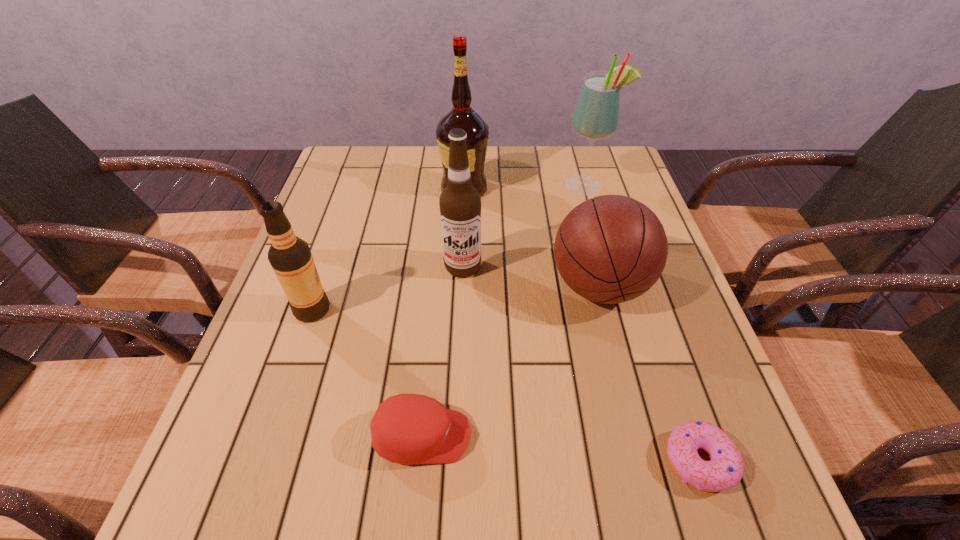
You are a GUI agent. You are given a task and a screenshot of the screen. Output one action in this format:
    pyautogui.click(x=<x>, y=<y>)
    Task: Click on the free space at the far edge of the desktop
    
    Given the screenshot: What is the action you would take?
    pyautogui.click(x=431, y=146)

Where is `vacant space at the near edge of the desktop`? The width and height of the screenshot is (960, 540). vacant space at the near edge of the desktop is located at coordinates (409, 489).

Locate an element on the screen. This screenshot has height=540, width=960. vacant position at the left edge of the desktop is located at coordinates (320, 199).

This screenshot has height=540, width=960. I want to click on free space at the right edge of the desktop, so click(x=676, y=388).

Identify the location of vacant space at the far left corner of the desktop. (322, 186).

The height and width of the screenshot is (540, 960). Find the location of `vacant space at the far right corner`. vacant space at the far right corner is located at coordinates (599, 173).

Where is `vacant space at the near right corner of the desktop`? vacant space at the near right corner of the desktop is located at coordinates (684, 484).

The width and height of the screenshot is (960, 540). Identify the location of free space between the doughnut and the second nearest alcohol. (581, 364).

Find the location of a particular element. free space between the cap and the second nearest alcohol is located at coordinates (443, 352).

Locate an element on the screen. free space between the basketball and the cap is located at coordinates (511, 361).